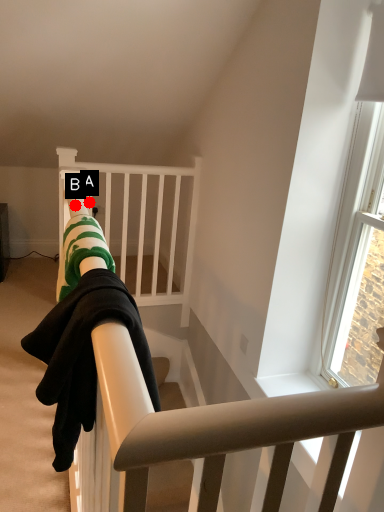
Question: Two points are circled on the image, labeled by A and B beside each circle. Which point is closer to the camera taking this photo?

Choices:
 (A) A is closer
 (B) B is closer

Answer: (B)